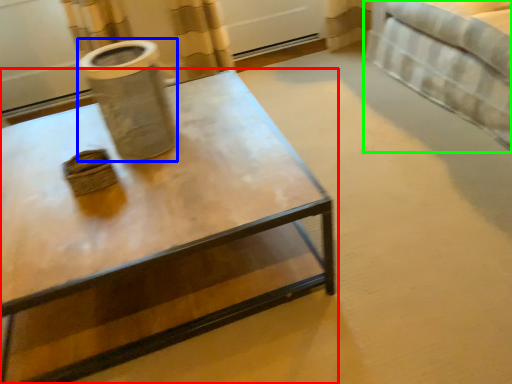
Question: Which object is the farthest from coffee table (highlighted by a red box)? Choose among these: vase (highlighted by a blue box) or bed (highlighted by a green box).

Choices:
 (A) vase
 (B) bed

Answer: (B)